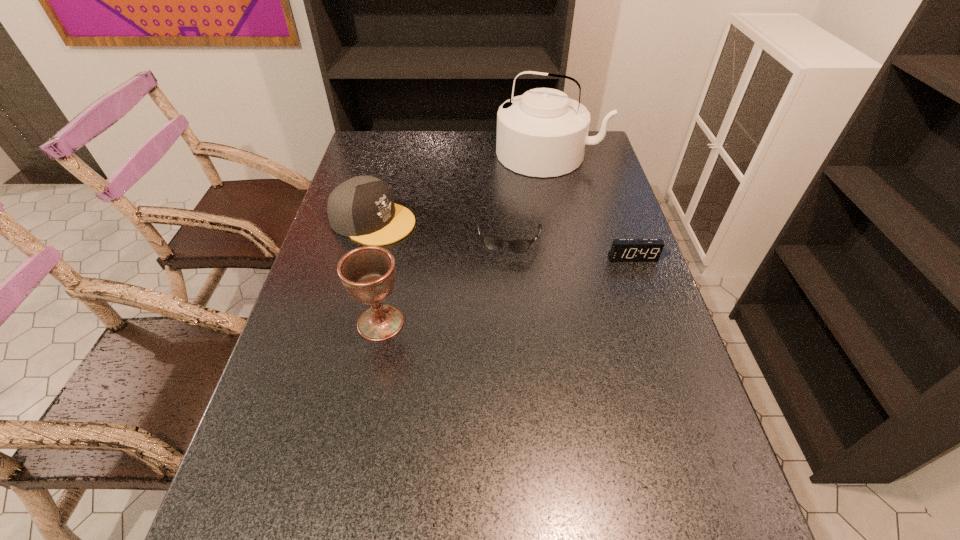
The height and width of the screenshot is (540, 960). I want to click on chalice, so click(x=367, y=273).

The height and width of the screenshot is (540, 960). I want to click on the fourth shortest object, so click(367, 273).

The height and width of the screenshot is (540, 960). Find the location of `alarm clock`. alarm clock is located at coordinates (623, 250).

What are the coordinates of `cap` in the screenshot? It's located at click(362, 208).

Where is `the tallest object`? The height and width of the screenshot is (540, 960). the tallest object is located at coordinates (543, 133).

Locate an element on the screen. Image resolution: width=960 pixels, height=540 pixels. the farthest object is located at coordinates (543, 133).

At what (x,y) coordinates should I click in order to perform the action: click on sunglasses. Please return your answer as a coordinate pair (x, y). Image resolution: width=960 pixels, height=540 pixels. Looking at the image, I should click on (493, 243).

Where is `vacant region located 0.270m on the right of the nearest object`? vacant region located 0.270m on the right of the nearest object is located at coordinates (517, 323).

What are the coordinates of `vacant region located on the front-facing side of the alarm clock` in the screenshot? It's located at (677, 385).

At what (x,y) coordinates should I click in order to perform the action: click on blank area located 0.310m on the front-facing side of the third tallest object. Please return your answer as a coordinate pair (x, y). Looking at the image, I should click on (504, 266).